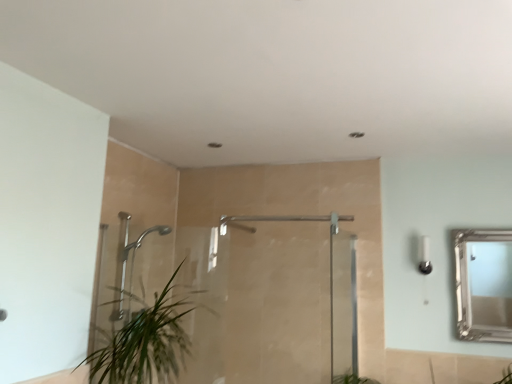
What do you see at coordinates (147, 342) in the screenshot? This screenshot has height=384, width=512. I see `green leafy plant at lower left` at bounding box center [147, 342].

The width and height of the screenshot is (512, 384). Describe the element at coordinates (132, 266) in the screenshot. I see `polished chrome shower head at left, placed as the second shower when sorted from right to left` at that location.

What do you see at coordinates (234, 224) in the screenshot? The width and height of the screenshot is (512, 384). I see `satin nickel shower at center, acting as the 1th shower starting from the right` at bounding box center [234, 224].

Image resolution: width=512 pixels, height=384 pixels. What do you see at coordinates (291, 303) in the screenshot?
I see `clear glass shower door at left, the first screen door positioned from the left` at bounding box center [291, 303].

Identify the location of green leafy plant at lower left. (147, 342).

Which of these two, polished chrome shower head at left, placed as the second shower when sorted from right to left, or clear glass door at center, the second screen door viewed from the left, stands taller?

clear glass door at center, the second screen door viewed from the left.

Choose the correct answer: Is polished chrome shower head at left, placed as the second shower when sorted from right to left, inside clear glass door at center, the second screen door viewed from the left, or outside it?

polished chrome shower head at left, placed as the second shower when sorted from right to left, lies outside clear glass door at center, the second screen door viewed from the left.

What's the angular difference between polished chrome shower head at left, the 1th shower in the left-to-right sequence, and clear glass door at center, which appears as the 1th screen door when viewed from the right,'s facing directions?

→ The angle between the facing direction of polished chrome shower head at left, the 1th shower in the left-to-right sequence, and the facing direction of clear glass door at center, which appears as the 1th screen door when viewed from the right, is 1.66 degrees.

From the image's perspective, is polished chrome shower head at left, placed as the second shower when sorted from right to left, beneath clear glass door at center, which appears as the 1th screen door when viewed from the right?

Actually, polished chrome shower head at left, placed as the second shower when sorted from right to left, appears above clear glass door at center, which appears as the 1th screen door when viewed from the right, in the image.

Is clear glass door at center, which appears as the 1th screen door when viewed from the right, wider than green leafy plant at lower left?

No.

Would you consider clear glass door at center, which appears as the 1th screen door when viewed from the right, to be distant from green leafy plant at lower left?

clear glass door at center, which appears as the 1th screen door when viewed from the right, is far away from green leafy plant at lower left.

Could you tell me if clear glass door at center, which appears as the 1th screen door when viewed from the right, is facing green leafy plant at lower left?

No, clear glass door at center, which appears as the 1th screen door when viewed from the right, does not turn towards green leafy plant at lower left.

Can you confirm if clear glass door at center, the second screen door viewed from the left, is taller than green leafy plant at lower left?

Indeed, clear glass door at center, the second screen door viewed from the left, has a greater height compared to green leafy plant at lower left.

Which object is thinner, silver/glass mirror at upper right or satin nickel shower at center, the second shower positioned from the left?

satin nickel shower at center, the second shower positioned from the left, is thinner.

Considering the positions of points (487, 308) and (220, 220), is point (487, 308) farther from camera compared to point (220, 220)?

No, (487, 308) is closer to viewer.

Where is `shower that is the 2nd object above the silver/glass mirror at upper right (from a real-world perspective)`? The image size is (512, 384). shower that is the 2nd object above the silver/glass mirror at upper right (from a real-world perspective) is located at coordinates (234, 224).

In terms of height, does clear glass shower door at left, the first screen door positioned from the left, look taller or shorter compared to silver/glass mirror at upper right?

Considering their sizes, clear glass shower door at left, the first screen door positioned from the left, has more height than silver/glass mirror at upper right.

Based on their sizes in the image, would you say clear glass shower door at left, the 2th screen door when ordered from right to left, is bigger or smaller than silver/glass mirror at upper right?

Clearly, clear glass shower door at left, the 2th screen door when ordered from right to left, is larger in size than silver/glass mirror at upper right.

Identify the location of mirror that appears above the clear glass shower door at left, the 2th screen door when ordered from right to left (from a real-world perspective). The height and width of the screenshot is (384, 512). (490, 283).

Which is farther from the camera, (290,249) or (479,249)?

Point (290,249)

You are a GUI agent. You are given a task and a screenshot of the screen. Output one action in this format:
    pyautogui.click(x=<x>, y=<y>)
    Task: Click on the 1st shower above the clear glass shower door at left, the first screen door positioned from the left (from a real-world perspective)
    The height and width of the screenshot is (384, 512).
    Given the screenshot: What is the action you would take?
    pyautogui.click(x=132, y=266)

From a real-world perspective, who is located lower, polished chrome shower head at left, the 1th shower in the left-to-right sequence, or clear glass shower door at left, the first screen door positioned from the left?

From a 3D spatial view, clear glass shower door at left, the first screen door positioned from the left, is below.

From the image's perspective, does polished chrome shower head at left, placed as the second shower when sorted from right to left, appear higher than clear glass shower door at left, the 2th screen door when ordered from right to left?

Yes.

Considering the positions of points (230, 220) and (253, 343), is point (230, 220) farther from camera compared to point (253, 343)?

Yes, point (230, 220) is farther from viewer.

Who is shorter, satin nickel shower at center, the second shower positioned from the left, or clear glass shower door at left, the first screen door positioned from the left?

satin nickel shower at center, the second shower positioned from the left.

Can we say satin nickel shower at center, the second shower positioned from the left, lies outside clear glass shower door at left, the 2th screen door when ordered from right to left?

Yes, satin nickel shower at center, the second shower positioned from the left, is not within clear glass shower door at left, the 2th screen door when ordered from right to left.

From the image's perspective, is satin nickel shower at center, the second shower positioned from the left, located beneath polished chrome shower head at left, placed as the second shower when sorted from right to left?

No, from the image's perspective, satin nickel shower at center, the second shower positioned from the left, is not beneath polished chrome shower head at left, placed as the second shower when sorted from right to left.

Is satin nickel shower at center, the second shower positioned from the left, not near polished chrome shower head at left, the 1th shower in the left-to-right sequence?

No, satin nickel shower at center, the second shower positioned from the left, is in close proximity to polished chrome shower head at left, the 1th shower in the left-to-right sequence.

Between satin nickel shower at center, acting as the 1th shower starting from the right, and polished chrome shower head at left, placed as the second shower when sorted from right to left, which one has less height?

satin nickel shower at center, acting as the 1th shower starting from the right, is shorter.

Is satin nickel shower at center, the second shower positioned from the left, oriented away from polished chrome shower head at left, placed as the second shower when sorted from right to left?

No.

Find the location of `screen door that is the 2nd one below the polished chrome shower head at left, the 1th shower in the left-to-right sequence (from a real-world perspective)`. screen door that is the 2nd one below the polished chrome shower head at left, the 1th shower in the left-to-right sequence (from a real-world perspective) is located at coordinates (343, 306).

Where is `screen door that is the 1st object located behind the green leafy plant at lower left`? screen door that is the 1st object located behind the green leafy plant at lower left is located at coordinates (343, 306).

From the image, which object appears to be farther from clear glass door at center, which appears as the 1th screen door when viewed from the right, clear glass shower door at left, the 2th screen door when ordered from right to left, or polished chrome shower head at left, the 1th shower in the left-to-right sequence?

polished chrome shower head at left, the 1th shower in the left-to-right sequence.

Considering their positions, is polished chrome shower head at left, placed as the second shower when sorted from right to left, positioned further to green leafy plant at lower left than satin nickel shower at center, the second shower positioned from the left?

Based on the image, satin nickel shower at center, the second shower positioned from the left, appears to be further to green leafy plant at lower left.

Considering their positions, is satin nickel shower at center, acting as the 1th shower starting from the right, positioned closer to polished chrome shower head at left, placed as the second shower when sorted from right to left, than silver/glass mirror at upper right?

satin nickel shower at center, acting as the 1th shower starting from the right, lies closer to polished chrome shower head at left, placed as the second shower when sorted from right to left, than the other object.

Estimate the real-world distances between objects in this image. Which object is further from green leafy plant at lower left, satin nickel shower at center, acting as the 1th shower starting from the right, or polished chrome shower head at left, the 1th shower in the left-to-right sequence?

satin nickel shower at center, acting as the 1th shower starting from the right, is positioned further to the anchor green leafy plant at lower left.

Which object lies nearer to the anchor point clear glass door at center, which appears as the 1th screen door when viewed from the right, polished chrome shower head at left, placed as the second shower when sorted from right to left, or satin nickel shower at center, acting as the 1th shower starting from the right?

satin nickel shower at center, acting as the 1th shower starting from the right, is positioned closer to the anchor clear glass door at center, which appears as the 1th screen door when viewed from the right.

Based on the photo, which object lies further to the anchor point clear glass shower door at left, the 2th screen door when ordered from right to left, polished chrome shower head at left, placed as the second shower when sorted from right to left, or clear glass door at center, the second screen door viewed from the left?

polished chrome shower head at left, placed as the second shower when sorted from right to left, lies further to clear glass shower door at left, the 2th screen door when ordered from right to left, than the other object.

Consider the image. Estimate the real-world distances between objects in this image. Which object is further from satin nickel shower at center, acting as the 1th shower starting from the right, clear glass shower door at left, the 2th screen door when ordered from right to left, or polished chrome shower head at left, placed as the second shower when sorted from right to left?

polished chrome shower head at left, placed as the second shower when sorted from right to left, is further to satin nickel shower at center, acting as the 1th shower starting from the right.

Considering their positions, is silver/glass mirror at upper right positioned closer to clear glass shower door at left, the first screen door positioned from the left, than polished chrome shower head at left, placed as the second shower when sorted from right to left?

Based on the image, polished chrome shower head at left, placed as the second shower when sorted from right to left, appears to be nearer to clear glass shower door at left, the first screen door positioned from the left.

Where is `screen door situated between polished chrome shower head at left, the 1th shower in the left-to-right sequence, and clear glass door at center, the second screen door viewed from the left, from left to right`? The width and height of the screenshot is (512, 384). screen door situated between polished chrome shower head at left, the 1th shower in the left-to-right sequence, and clear glass door at center, the second screen door viewed from the left, from left to right is located at coordinates (291, 303).

Find the location of a particular element. The image size is (512, 384). screen door situated between polished chrome shower head at left, placed as the second shower when sorted from right to left, and satin nickel shower at center, the second shower positioned from the left, from left to right is located at coordinates (291, 303).

At what (x,y) coordinates should I click in order to perform the action: click on houseplant between polished chrome shower head at left, the 1th shower in the left-to-right sequence, and clear glass door at center, the second screen door viewed from the left. Please return your answer as a coordinate pair (x, y). The height and width of the screenshot is (384, 512). Looking at the image, I should click on (147, 342).

Locate an element on the screen. houseplant situated between polished chrome shower head at left, placed as the second shower when sorted from right to left, and silver/glass mirror at upper right from left to right is located at coordinates (147, 342).